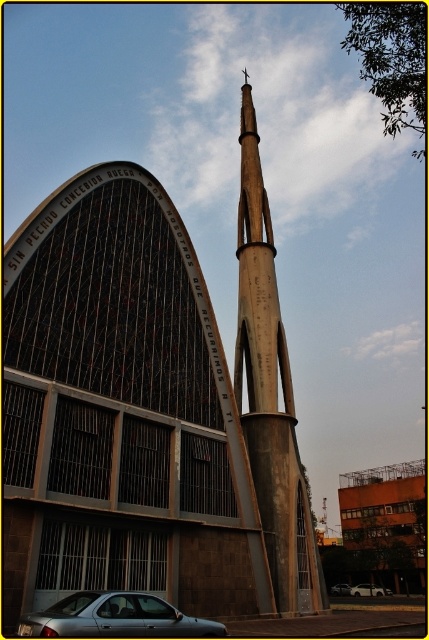
You are a photographer positioned at the base of the orange brick building at center and want to capture the satin silver sedan at center in your shot. Can you see the entire sedan without moving your camera? Explain your reasoning based on their positions.

The orange brick building at center is located above the satin silver sedan at center, so the building might block part of the sedan from view. Therefore, you might not be able to see the entire sedan without moving your camera.

You are a photographer planning to take a wide shot of the orange brick building at center and the satin silver sedan at center. Given that the sedan is narrower than the building, how should you position your camera to ensure both are fully in frame without cropping?

Since the orange brick building at center is wider than the satin silver sedan at center, position the camera slightly closer to the building to capture its full width while still including the sedan in the frame. This adjustment ensures both objects are visible without cropping.